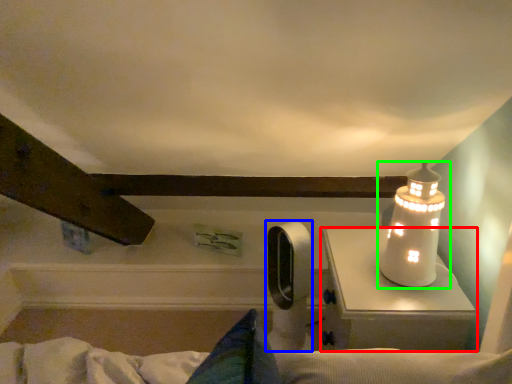
Question: Which is nearer to the table (highlighted by a red box)? equipment (highlighted by a blue box) or lamp (highlighted by a green box).

Choices:
 (A) equipment
 (B) lamp

Answer: (B)